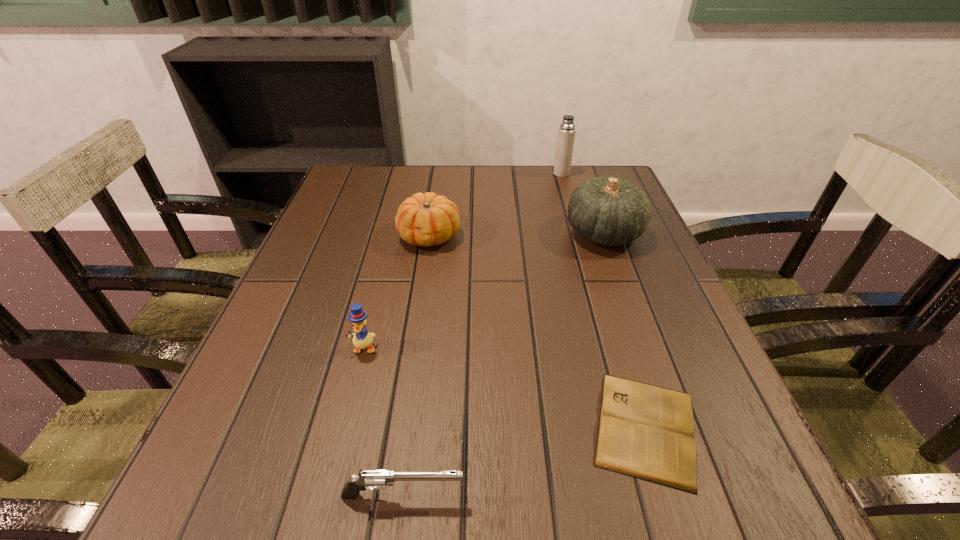
Image resolution: width=960 pixels, height=540 pixels. Identify the location of the farthest object. (566, 132).

Where is `the right gourd`? The image size is (960, 540). the right gourd is located at coordinates [x=609, y=211].

Find the location of a particular element. the fourth farthest object is located at coordinates (362, 339).

The width and height of the screenshot is (960, 540). In order to click on the left gourd in this screenshot , I will do `click(427, 219)`.

Find the location of a particular element. The image size is (960, 540). the second shortest object is located at coordinates (371, 479).

At what (x,y) coordinates should I click in order to perform the action: click on book. Please return your answer as a coordinate pair (x, y). The height and width of the screenshot is (540, 960). Looking at the image, I should click on (645, 431).

Locate an element on the screen. vacant space located on the front of the thermos bottle is located at coordinates (588, 262).

Where is `blank space located 0.320m on the left of the right gourd`? This screenshot has height=540, width=960. blank space located 0.320m on the left of the right gourd is located at coordinates (429, 233).

This screenshot has height=540, width=960. Identify the location of free space located on the face of the third nearest object, where the monocle is placed. (349, 406).

Find the location of a particular element. The height and width of the screenshot is (540, 960). vacant space located on the front of the left gourd is located at coordinates (410, 373).